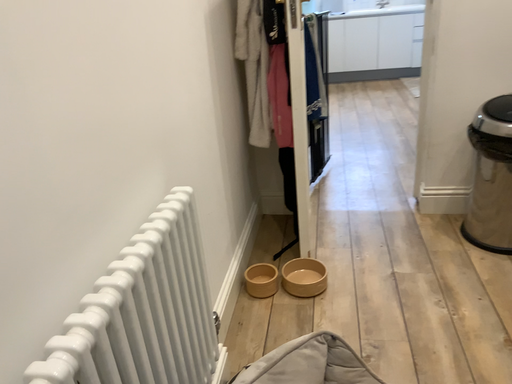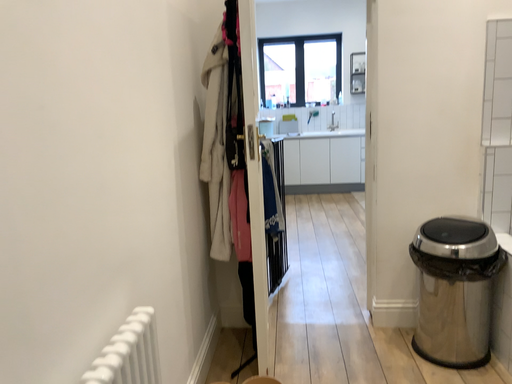
Question: Which way did the camera rotate in the video?

Choices:
 (A) rotated upward
 (B) rotated downward

Answer: (A)